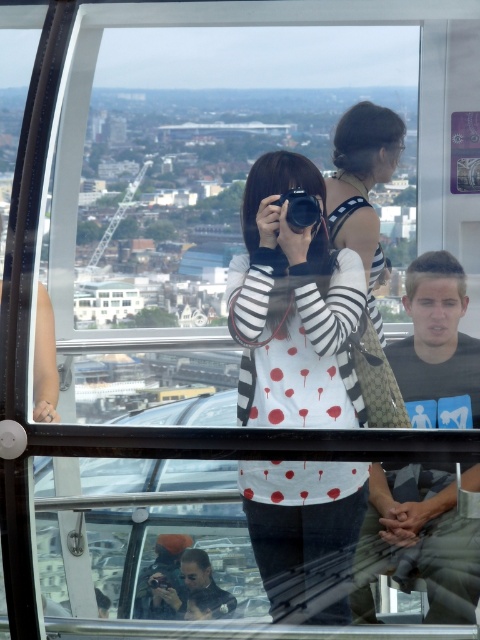
You are standing on the observation deck and want to take a photo of both the point at coordinates point (256, 248) and point (441, 572). Which point should you focus on first to ensure both are in the frame?

You should focus on point (256, 248) first because it is closer to you than point (441, 572). This way, adjusting the camera to include both points will be easier as you can zoom out from the closer point to include the farther one.